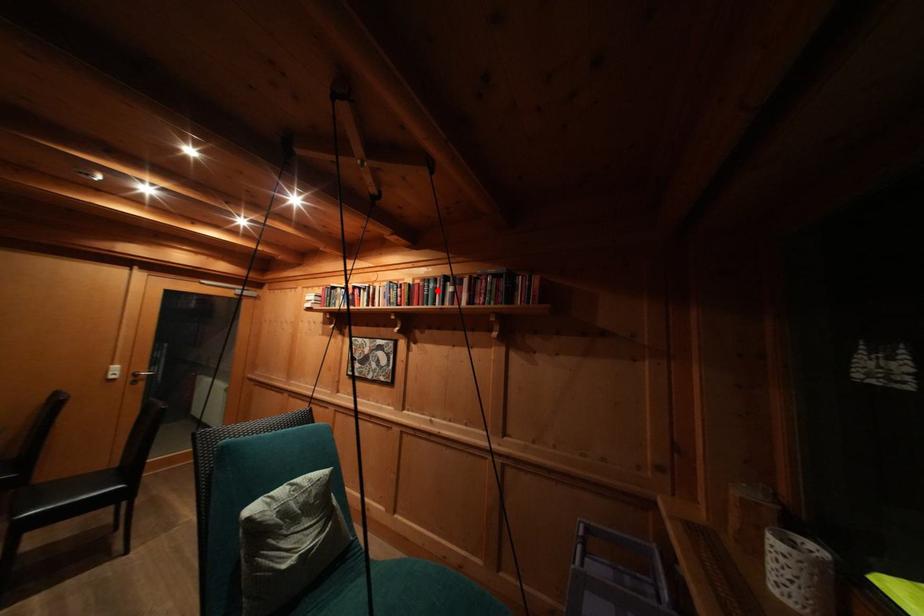
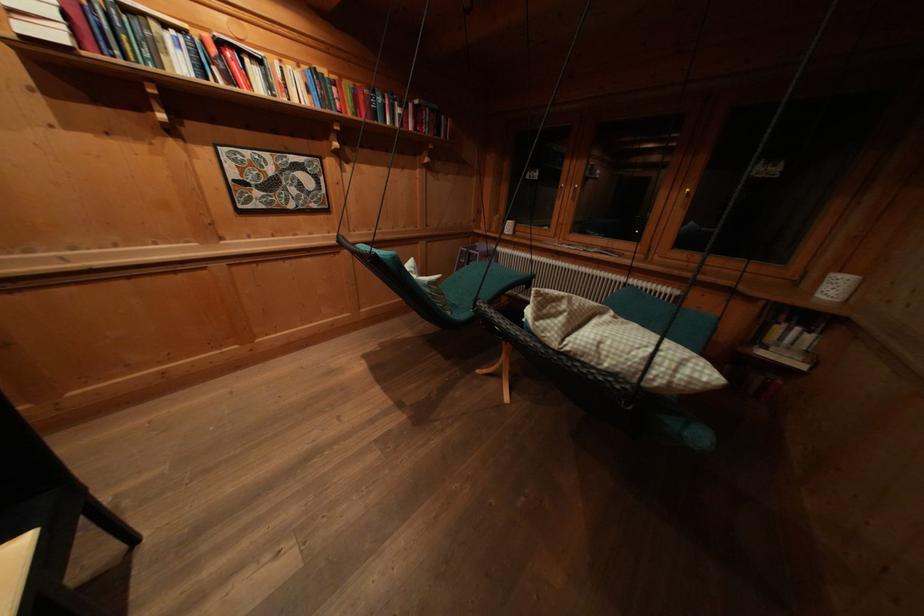
In the second image, find the point that corresponds to the highlighted location in the first image.

(385, 103)